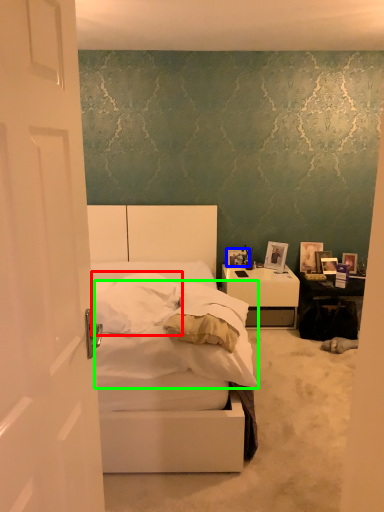
Question: Which is nearer to the pillow (highlighted by a red box)? picture frame (highlighted by a blue box) or mattress (highlighted by a green box).

Choices:
 (A) picture frame
 (B) mattress

Answer: (B)